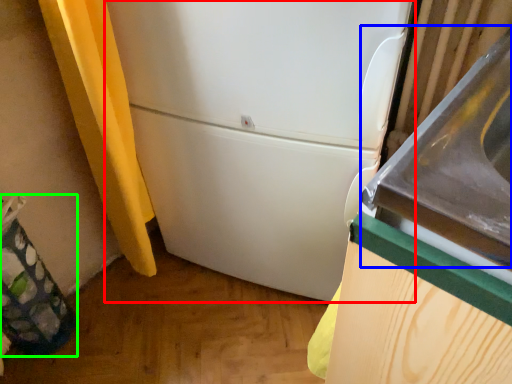
Question: Based on their relative distances, which object is farther from refrigerator (highlighted by a red box)? Choose from sink (highlighted by a blue box) and garbage (highlighted by a green box).

Choices:
 (A) sink
 (B) garbage

Answer: (B)